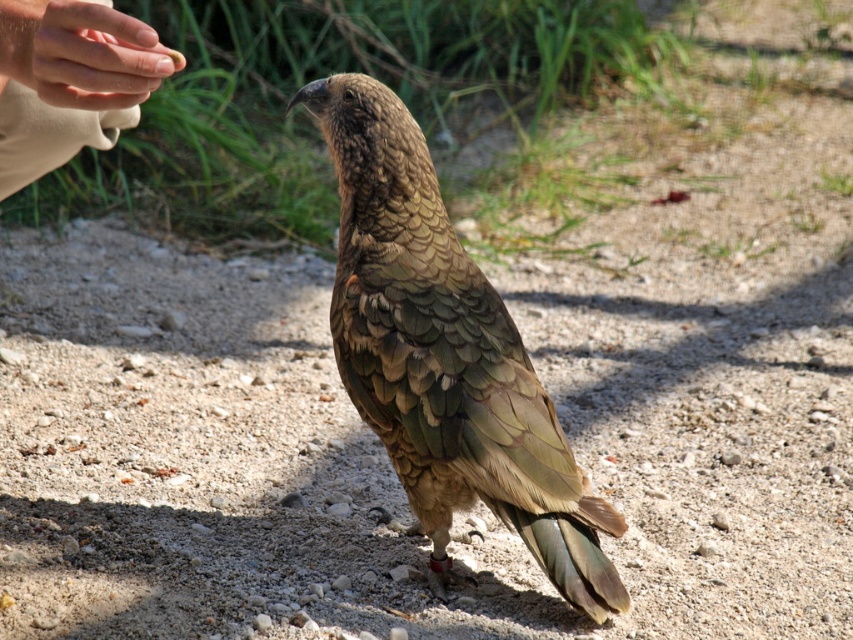
You are a wildlife photographer aiming to capture a close shot of the brown feathered bird at center. If your camera has a minimum focusing distance of 5 feet, will you be able to take the photo without moving closer?

The brown feathered bird at center is 6.70 feet away from the viewer. Since the camera can focus as close as 5 feet, you can take the photo without moving closer because the distance is within the camera

You are a researcher studying the kea bird and need to place a tracking device on the bird. The device can be placed at either point 1 at coordinates point (479, 412) or point 2 at coordinates point (125, 84). Which point is closer to the bird?

Point 2 at coordinates point (125, 84) is closer to the bird because point (479, 412) is behind point (125, 84), meaning point (125, 84) is in front and thus closer to the bird.

You are a photographer aiming to capture the bird in the image without disturbing it. You notice a skinny tan hand at upper left in the frame. Where should you position your camera to ensure the bird remains the main focus while avoiding the hand?

Position your camera so that the bird is centered in the frame and the skinny tan hand at upper left is outside the shot. Since the hand is located at coordinates approximately 0.128 on the x and 0.082 on the y axis, adjusting the camera angle slightly downward or to the right would exclude the hand while keeping the bird as the main subject.